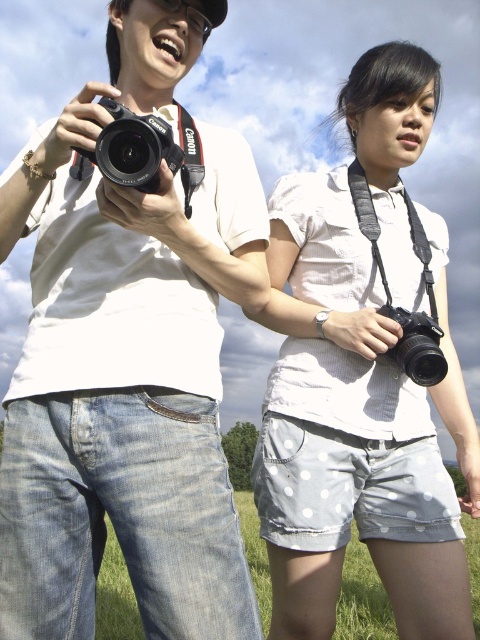
You are a photographer trying to capture a photo of the white dotted shorts at center without the camera in the frame. Based on the scene description, can you position yourself in a way to achieve this?

The distance between the white dotted shorts at center and the camera is 5.42 feet. To capture the white dotted shorts at center without the camera in the frame, position yourself at least 5.42 feet away from the camera towards the shorts.

You are a photographer trying to capture a closeup of the white dotted shorts at center and the green grass at lower center. Which object should you zoom in on to ensure it fills more of the frame without moving the camera?

The white dotted shorts at center has a lesser width compared to green grass at lower center, so you should zoom in on the green grass at lower center to fill more of the frame since it is wider.

You are a photographer trying to locate your matte black camera. You remember it was placed at a specific coordinate in the image. Which object from the scene corresponds to the coordinates point (128, 358)?

The point (128, 358) corresponds to the matte black camera at left.